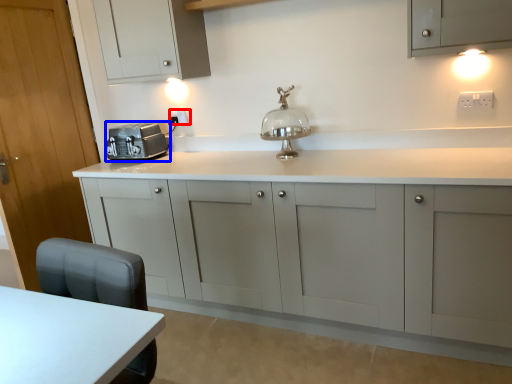
Question: Which object appears closest to the camera in this image, electric outlet (highlighted by a red box) or home appliance (highlighted by a blue box)?

Choices:
 (A) electric outlet
 (B) home appliance

Answer: (B)